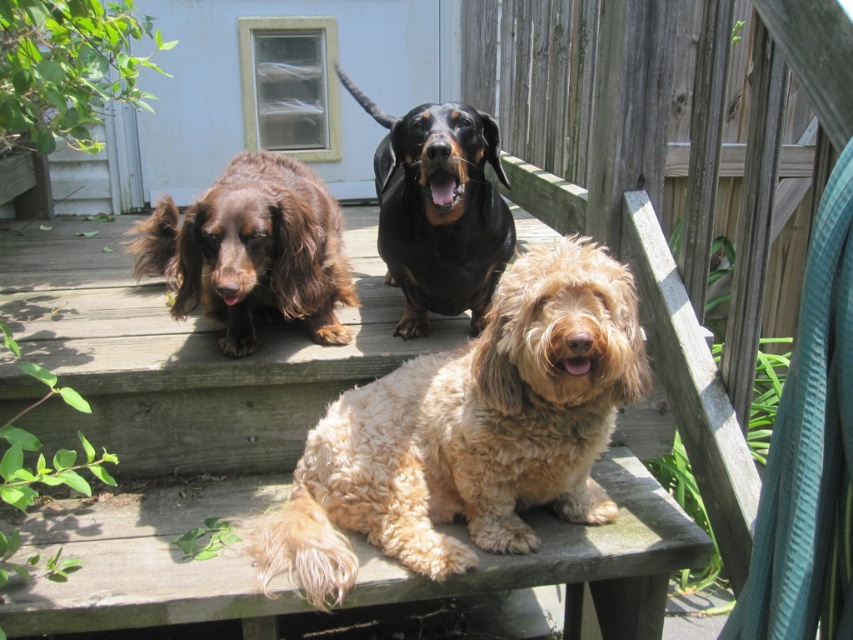
Does fuzzy golden dog at center appear under black shiny dachshund at center?

Indeed, fuzzy golden dog at center is positioned under black shiny dachshund at center.

Is point (422, 540) in front of point (492, 243)?

Yes, it is.

This screenshot has width=853, height=640. Find the location of `fuzzy golden dog at center`. fuzzy golden dog at center is located at coordinates click(469, 433).

I want to click on brown furry dog at left, so click(252, 252).

Does brown furry dog at left lie in front of black shiny dachshund at center?

That is False.

This screenshot has height=640, width=853. Find the location of `brown furry dog at left`. brown furry dog at left is located at coordinates tap(252, 252).

Can you confirm if fuzzy golden dog at center is taller than brown furry dog at left?

Indeed, fuzzy golden dog at center has a greater height compared to brown furry dog at left.

Is point (590, 333) closer to viewer compared to point (230, 211)?

Yes.

Between point (318, 593) and point (318, 337), which one is positioned in front?

Positioned in front is point (318, 593).

The height and width of the screenshot is (640, 853). What are the coordinates of `fuzzy golden dog at center` in the screenshot? It's located at (469, 433).